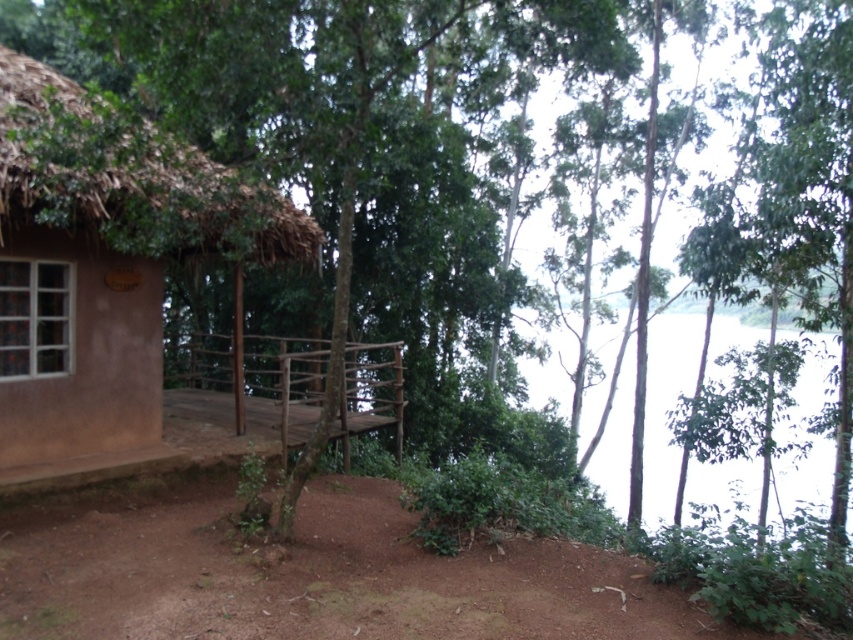
Does brown clay hut at left have a larger size compared to wooden at center?

Actually, brown clay hut at left might be smaller than wooden at center.

Does point (27, 132) lie in front of point (189, 380)?

Yes, it is in front of point (189, 380).

Between point (88, 134) and point (209, 401), which one is positioned behind?

The point (209, 401) is more distant.

This screenshot has height=640, width=853. What are the coordinates of `brown clay hut at left` in the screenshot? It's located at (103, 275).